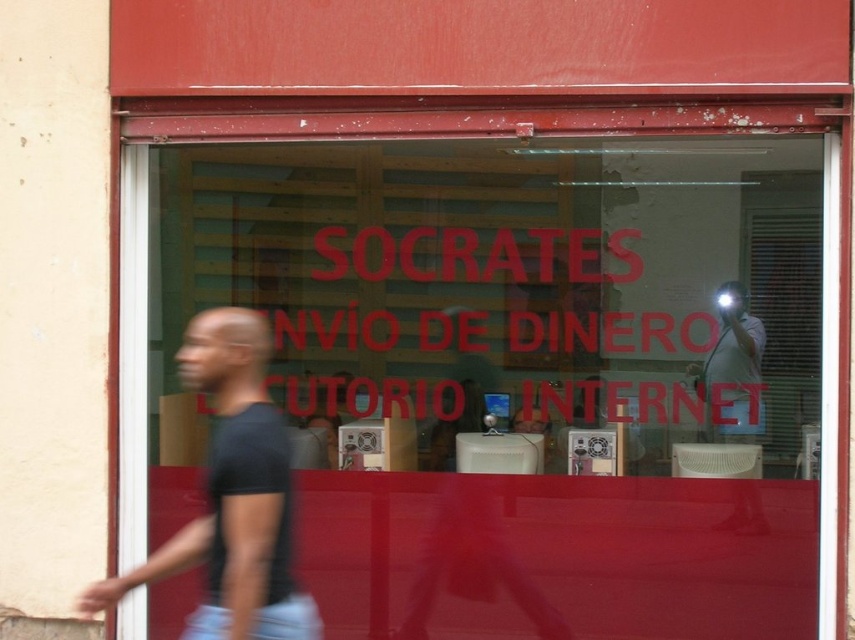
You are a customer standing outside the store looking through the glass window. You notice two points inside the store marked as point (193, 369) and point (724, 371). Which point is closer to you?

Point (193, 369) is closer to the camera than point (724, 371).

You are a photographer trying to capture both the black matte shirt at left and the white glossy camera at upper right in a single frame. Based on their positions and sizes, which object should you focus on first to ensure both are in the frame?

The black matte shirt at left might be wider than white glossy camera at upper right, so you should focus on the black matte shirt at left first to ensure both are in the frame.